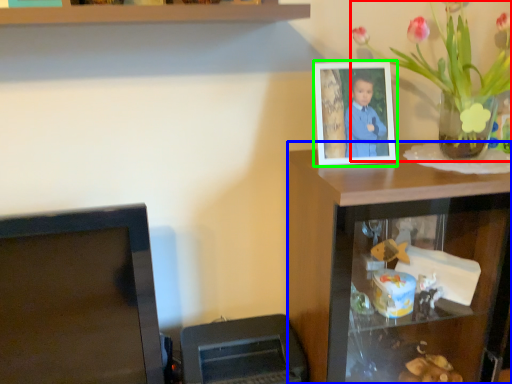
Question: Which object is the farthest from houseplant (highlighted by a red box)? Choose among these: computer desk (highlighted by a blue box) or picture frame (highlighted by a green box).

Choices:
 (A) computer desk
 (B) picture frame

Answer: (A)